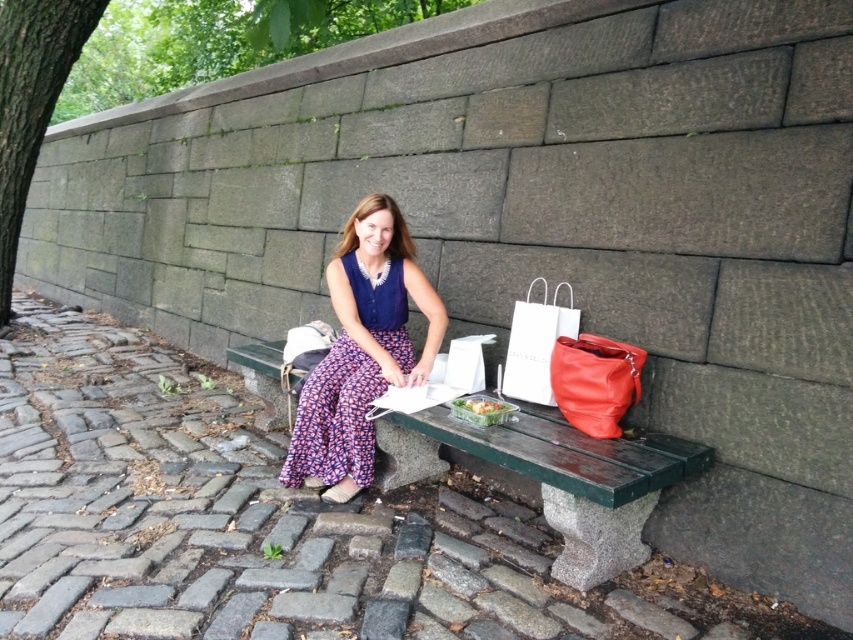
Question: Which object appears farthest from the camera in this image?

Choices:
 (A) green polished wood bench at center
 (B) blue fabric dress at center
 (C) translucent plastic container at center
 (D) shiny leather bag at right

Answer: (B)

Question: Which object is farther from the camera taking this photo?

Choices:
 (A) shiny leather bag at right
 (B) white paper bag at right
 (C) translucent plastic container at center

Answer: (B)

Question: Is shiny leather bag at right thinner than white paper bag at right?

Choices:
 (A) yes
 (B) no

Answer: (B)

Question: Does shiny leather bag at right appear on the right side of translucent plastic container at center?

Choices:
 (A) no
 (B) yes

Answer: (B)

Question: Which of the following is the farthest from the observer?

Choices:
 (A) pyautogui.click(x=639, y=376)
 (B) pyautogui.click(x=625, y=568)
 (C) pyautogui.click(x=405, y=332)
 (D) pyautogui.click(x=471, y=406)

Answer: (C)

Question: Can you confirm if blue fabric dress at center is positioned below white paper bag at right?

Choices:
 (A) yes
 (B) no

Answer: (A)